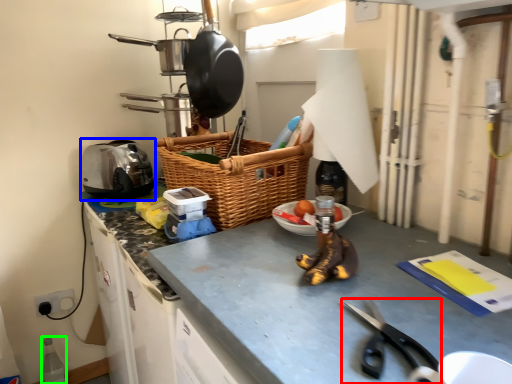
Question: Considering the real-world distances, which object is farthest from scissors (highlighted by a red box)? appliance (highlighted by a blue box) or bottle (highlighted by a green box)?

Choices:
 (A) appliance
 (B) bottle

Answer: (B)